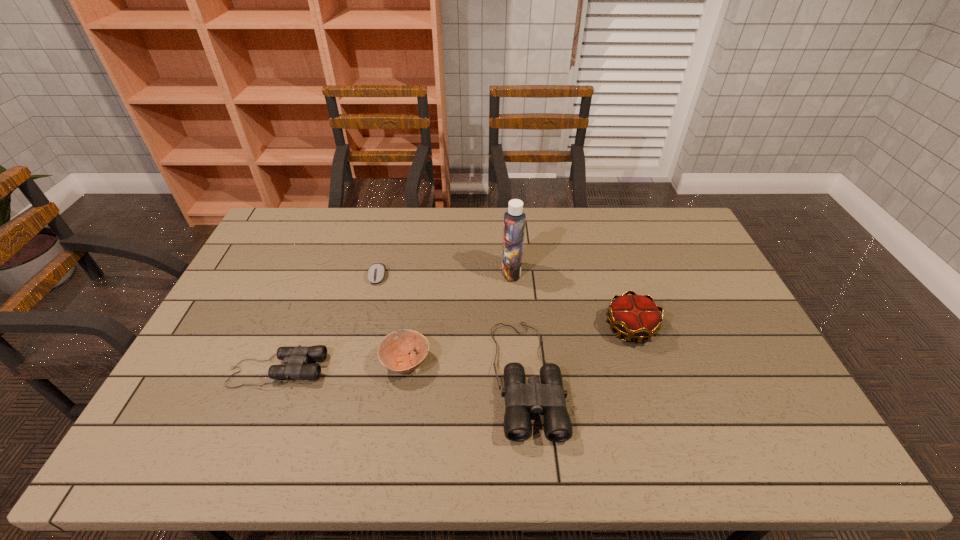
Locate an element on the screen. vacant space located 0.120m on the left of the rightmost object is located at coordinates (564, 327).

Identify the location of vacant point located on the wheel side of the shortest object. The width and height of the screenshot is (960, 540). (366, 325).

At what (x,y) coordinates should I click in order to perform the action: click on free space located 0.110m on the front label of the tallest object. Please return your answer as a coordinate pair (x, y). Looking at the image, I should click on (469, 272).

At what (x,y) coordinates should I click in order to perform the action: click on vacant space located on the front label of the tallest object. Please return your answer as a coordinate pair (x, y). Looking at the image, I should click on (395, 272).

This screenshot has width=960, height=540. What are the coordinates of `vacant space situated 0.370m on the front label of the tallest object` in the screenshot? It's located at (392, 272).

Locate an element on the screen. This screenshot has height=540, width=960. free point located 0.300m on the left of the fourth object from right to left is located at coordinates (273, 362).

I want to click on object that is at the left edge, so click(296, 358).

Find the location of `object located in the near left corner section of the desktop`. object located in the near left corner section of the desktop is located at coordinates (296, 358).

Identify the location of vacant space at the far edge of the desktop. (475, 235).

Image resolution: width=960 pixels, height=540 pixels. I want to click on vacant space at the near edge of the desktop, so click(x=304, y=396).